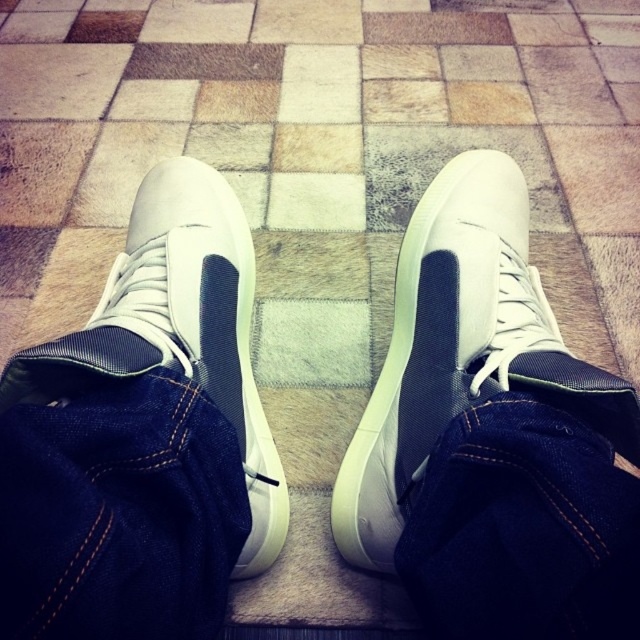
Is point (620, 390) positioned in front of point (33, 381)?

Yes, point (620, 390) is in front of point (33, 381).

Which is below, white leather sneaker at center or white matte/suede sneaker at center?

white matte/suede sneaker at center is below.

Which is behind, point (518, 372) or point (141, 296)?

Point (141, 296)

Find the location of `white leather sneaker at center`. white leather sneaker at center is located at coordinates (461, 349).

Which is in front, point (160, 403) or point (156, 237)?

Point (160, 403) is in front.

Image resolution: width=640 pixels, height=640 pixels. Describe the element at coordinates (120, 515) in the screenshot. I see `denim at center` at that location.

Who is more forward, (38, 477) or (176, 257)?

Point (38, 477) is more forward.

The width and height of the screenshot is (640, 640). I want to click on denim at center, so click(x=120, y=515).

Is point (492, 403) positioned after point (195, 346)?

No, (492, 403) is in front of (195, 346).

Does dark blue denim jeans at center lie in front of white matte/suede sneaker at center?

Yes, dark blue denim jeans at center is closer to the viewer.

Who is more forward, (470, 512) or (132, 246)?

Point (470, 512)

At what (x,y) coordinates should I click in order to perform the action: click on dark blue denim jeans at center. Please return your answer as a coordinate pair (x, y). Image resolution: width=640 pixels, height=640 pixels. Looking at the image, I should click on (522, 529).